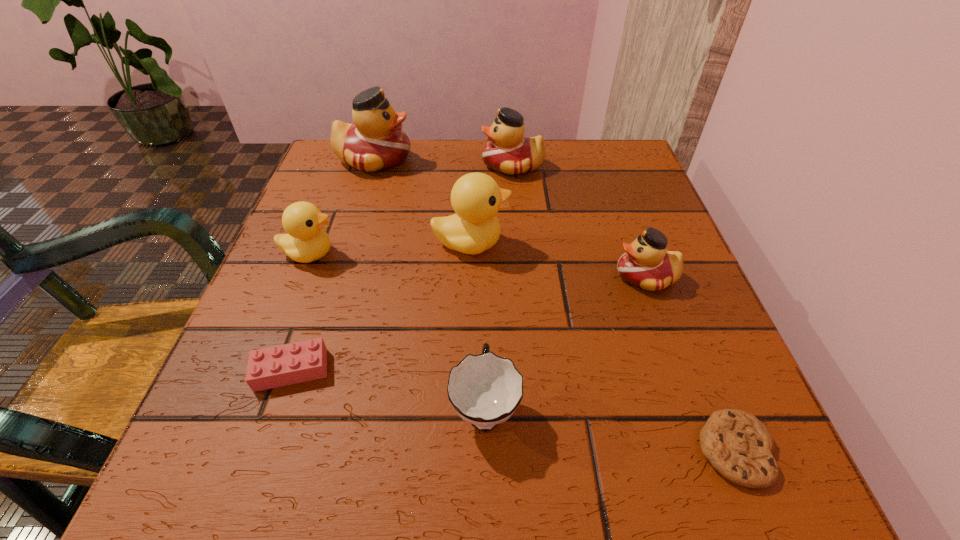
The width and height of the screenshot is (960, 540). Identify the location of free space between the second biggest red duck and the Lego. (402, 268).

This screenshot has height=540, width=960. In order to click on free point between the bigger yellow duck and the left yellow duck in this screenshot , I will do `click(391, 248)`.

This screenshot has height=540, width=960. What are the coordinates of `free space between the smallest red duck and the left yellow duck` in the screenshot? It's located at (478, 265).

Identify the location of unoccupied area between the Lego and the third shortest object. The height and width of the screenshot is (540, 960). (388, 388).

You are a GUI agent. You are given a task and a screenshot of the screen. Output one action in this format:
    pyautogui.click(x=<x>, y=<y>)
    Task: Click on the empty location between the second smallest red duck and the leftmost red duck
    The height and width of the screenshot is (540, 960).
    Given the screenshot: What is the action you would take?
    pos(444,163)

This screenshot has height=540, width=960. What are the coordinates of `free space between the rightmost red duck and the cup` in the screenshot? It's located at (565, 341).

Identify the location of vacant space that is in between the leftmost red duck and the smallest red duck. tap(510, 218).

Locate an element on the screen. The width and height of the screenshot is (960, 540). unoccupied area between the rightmost red duck and the second smallest red duck is located at coordinates (580, 221).

The height and width of the screenshot is (540, 960). I want to click on vacant space that's between the second biggest red duck and the nearest red duck, so click(x=580, y=221).

Select which object is the fourth closest to the right yellow duck. Please provide its 2D coordinates. Your answer should be formatted as a tuple, i.e. [(x, y)], where the tuple contains the x and y coordinates of a point satisfying the conditions above.

[(646, 264)]